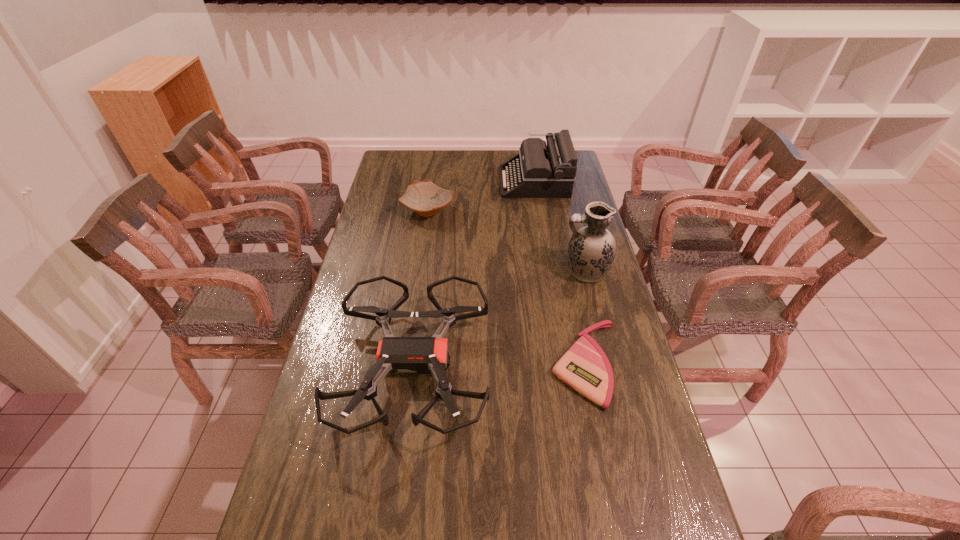
Locate an element on the screen. vacant space that satisfies the following two spatial constraints: 1. on the typing side of the fourth shortest object; 2. with the handle on the side of the tallest object is located at coordinates (549, 271).

Image resolution: width=960 pixels, height=540 pixels. I want to click on vacant space that satisfies the following two spatial constraints: 1. on the typing side of the second tallest object; 2. on the right side of the wristlet, so click(x=564, y=364).

The image size is (960, 540). I want to click on blank space that satisfies the following two spatial constraints: 1. on the typing side of the typewriter; 2. with the handle on the side of the third nearest object, so click(549, 271).

Identify the location of free space that satisfies the following two spatial constraints: 1. on the typing side of the second tallest object; 2. on the left side of the shortest object. This screenshot has width=960, height=540. (564, 364).

This screenshot has height=540, width=960. In order to click on free location that satisfies the following two spatial constraints: 1. on the typing side of the second tallest object; 2. with the camera facing forward on the third shortest object in this screenshot , I will do `click(564, 366)`.

Locate an element on the screen. This screenshot has width=960, height=540. free space that satisfies the following two spatial constraints: 1. on the typing side of the typewriter; 2. on the left side of the shortest object is located at coordinates (564, 364).

This screenshot has height=540, width=960. In order to click on vacant space that satisfies the following two spatial constraints: 1. on the typing side of the shortest object; 2. on the right side of the typewriter in this screenshot , I will do `click(564, 364)`.

Image resolution: width=960 pixels, height=540 pixels. In order to click on vacant area in the image that satisfies the following two spatial constraints: 1. on the back side of the shortest object; 2. on the typing side of the typewriter in this screenshot , I will do `click(549, 181)`.